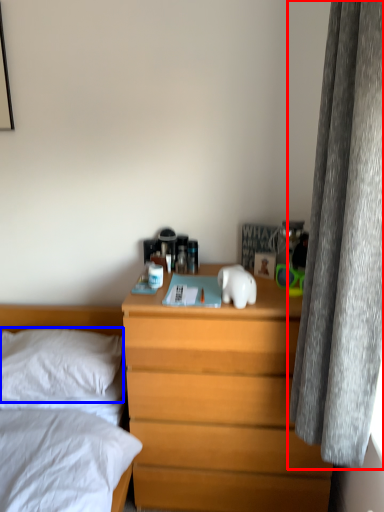
Question: Which object appears farthest to the camera in this image, curtain (highlighted by a red box) or pillow (highlighted by a blue box)?

Choices:
 (A) curtain
 (B) pillow

Answer: (B)